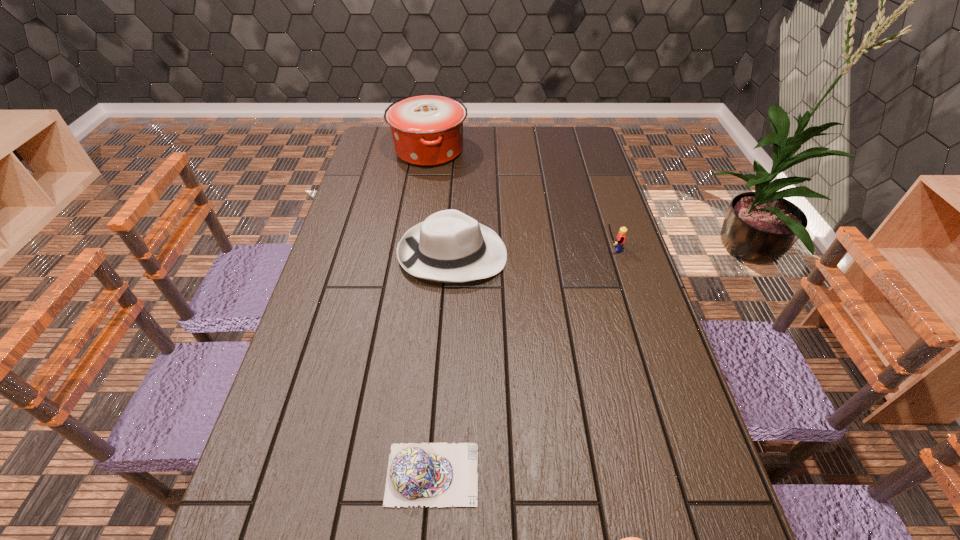
The width and height of the screenshot is (960, 540). Identify the location of the tallest object. (427, 130).

The width and height of the screenshot is (960, 540). I want to click on the farthest object, so click(427, 130).

Identify the location of fedora. (449, 246).

Locate an element on the screen. Image resolution: width=960 pixels, height=540 pixels. Lego is located at coordinates (618, 244).

Where is `the second nearest object`? The width and height of the screenshot is (960, 540). the second nearest object is located at coordinates (438, 475).

The image size is (960, 540). I want to click on vacant space located on the front of the farthest object, so click(x=420, y=216).

Find the location of a particular element. vacant space located on the front-facing side of the fedora is located at coordinates (564, 254).

This screenshot has height=540, width=960. What are the coordinates of `free space located 0.280m on the front-facing side of the Lego` in the screenshot? It's located at (508, 249).

The width and height of the screenshot is (960, 540). In order to click on free point located on the front-facing side of the Lego in this screenshot , I will do `click(554, 249)`.

Find the location of a particular element. The image size is (960, 540). blank space located on the front-facing side of the Lego is located at coordinates (564, 249).